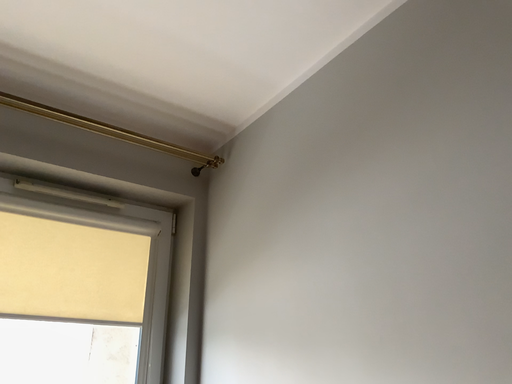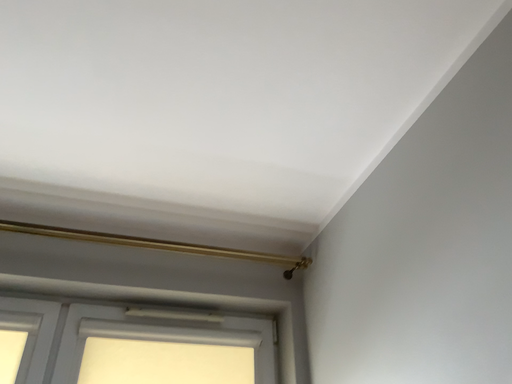
Question: Which way did the camera rotate in the video?

Choices:
 (A) rotated upward
 (B) rotated downward

Answer: (A)